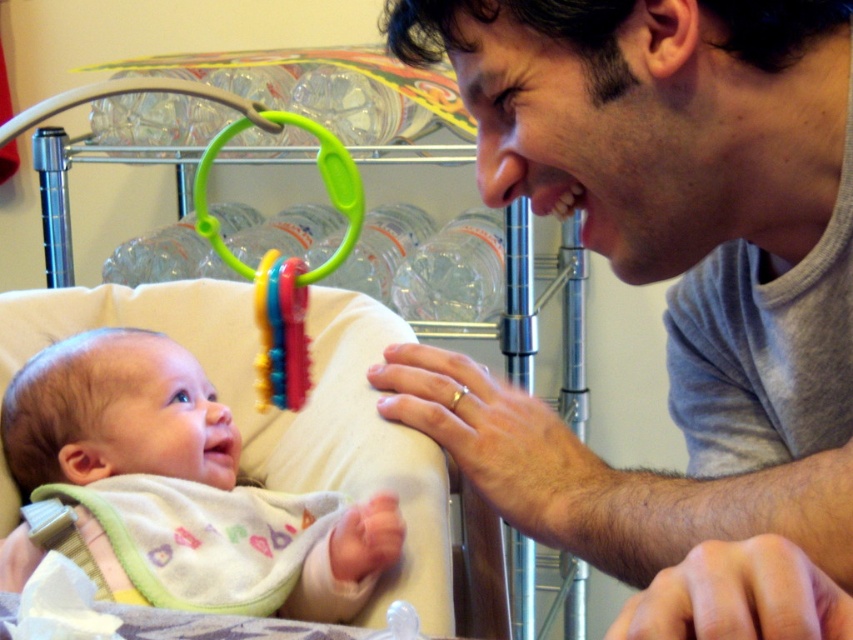
In the scene, there are two rubber teething rings. One is a rubberized plastic teething ring at upper center and the other is a rubber teething ring at lower center. Which one is located above the other?

The rubberized plastic teething ring at upper center is positioned over the rubber teething ring at lower center, so the one at upper center is above the one at lower center.

You are a parent holding a soft white bib at center and a rubber teething ring at lower center. You want to give the baby the teething ring but need to place the bib first. Can you hand the bib to the baby without moving the teething ring?

The soft white bib at center and rubber teething ring at lower center are 11.04 inches apart. Since the bib is positioned above the teething ring, you can place the bib first without disturbing the teething ring.

You are a parent trying to decide which item to use for your baby. The soft white bib at center and the rubber teething ring at lower center are both in the bassinet. Which item is wider?

The soft white bib at center is wider than the rubber teething ring at lower center.